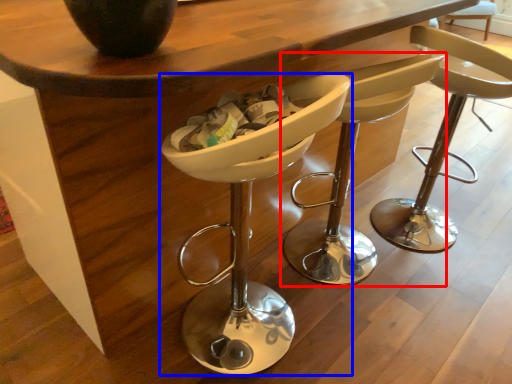
Question: Which object appears closest to the camera in this image, chair (highlighted by a red box) or chair (highlighted by a blue box)?

Choices:
 (A) chair
 (B) chair

Answer: (B)